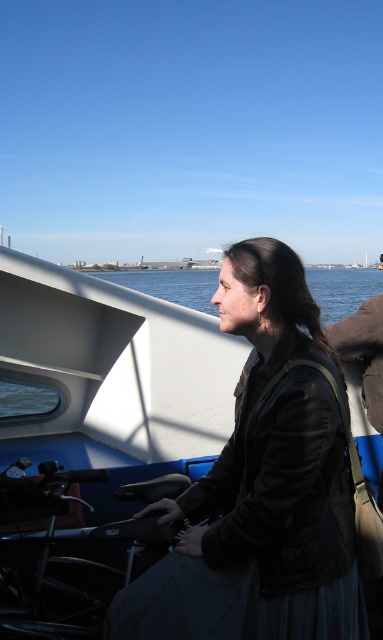
Who is more forward, (147,589) or (309,273)?

Point (147,589) is in front.

Which is in front, point (258, 529) or point (361, 273)?

Point (258, 529) is in front.

You are a GUI agent. You are given a task and a screenshot of the screen. Output one action in this format:
    pyautogui.click(x=<x>, y=<y>)
    Task: Click on the white matte boat at center
    This screenshot has width=383, height=640.
    Given the screenshot: What is the action you would take?
    pyautogui.click(x=183, y=458)